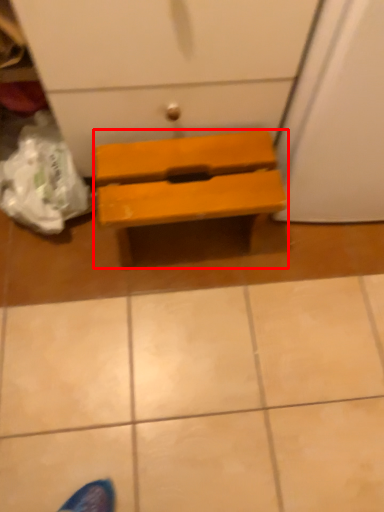
Question: Where is furniture (annotated by the red box) located in relation to tile in the image?

Choices:
 (A) left
 (B) right

Answer: (A)